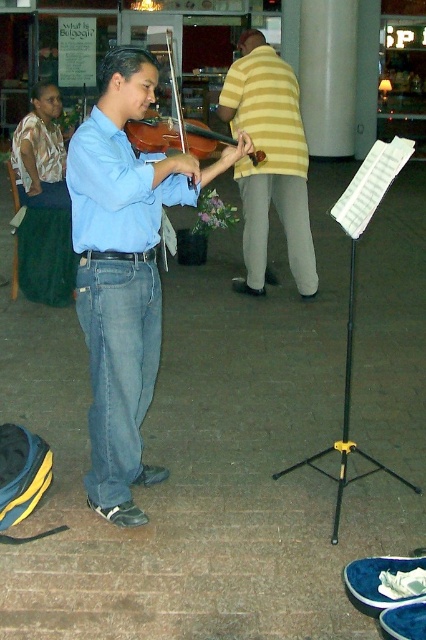
Question: Among these objects, which one is nearest to the camera?

Choices:
 (A) denim jeans at center
 (B) wooden violin at center
 (C) matte blue shirt at center
 (D) yellow striped shirt at center

Answer: (C)

Question: Which point is closer to the camera?

Choices:
 (A) wooden violin at center
 (B) matte blue shirt at center
 (C) yellow striped shirt at center
 (D) denim jeans at center

Answer: (B)

Question: Does matte blue shirt at center appear on the left side of yellow striped shirt at center?

Choices:
 (A) no
 (B) yes

Answer: (B)

Question: Is matte blue shirt at center above yellow striped shirt at center?

Choices:
 (A) yes
 (B) no

Answer: (B)

Question: Which point is closer to the camera taking this photo?

Choices:
 (A) (195, 141)
 (B) (261, 186)
 (C) (94, 173)

Answer: (C)

Question: Is matte blue shirt at center wider than yellow striped shirt at center?

Choices:
 (A) no
 (B) yes

Answer: (A)